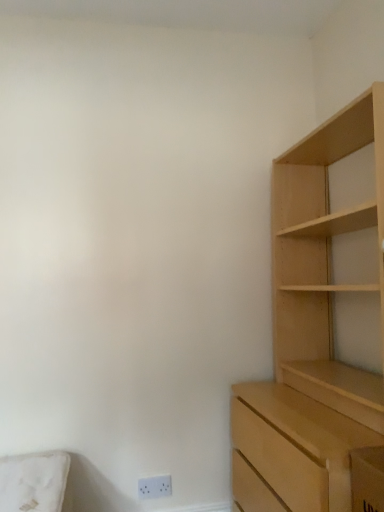
The height and width of the screenshot is (512, 384). In order to click on white plastic electric outlet at lower center in this screenshot , I will do `click(155, 487)`.

The width and height of the screenshot is (384, 512). Describe the element at coordinates (155, 487) in the screenshot. I see `white plastic electric outlet at lower center` at that location.

In order to face light wood cupboard at right, should I rotate leftwards or rightwards?

Rotate right and turn 17.130 degrees.

In order to click on light wood cupboard at right in this screenshot , I will do `click(311, 334)`.

What do you see at coordinates (311, 334) in the screenshot? Image resolution: width=384 pixels, height=512 pixels. I see `light wood cupboard at right` at bounding box center [311, 334].

The image size is (384, 512). Find the location of `white plastic electric outlet at lower center`. white plastic electric outlet at lower center is located at coordinates (155, 487).

Between white plastic electric outlet at lower center and light wood cupboard at right, which one appears on the left side from the viewer's perspective?

From the viewer's perspective, white plastic electric outlet at lower center appears more on the left side.

Considering the relative positions of white plastic electric outlet at lower center and light wood cupboard at right in the image provided, is white plastic electric outlet at lower center behind light wood cupboard at right?

Yes, the depth of white plastic electric outlet at lower center is greater than that of light wood cupboard at right.

Which is nearer, (150, 482) or (341, 217)?

Positioned in front is point (341, 217).

From the image's perspective, between white plastic electric outlet at lower center and light wood cupboard at right, which one is located above?

light wood cupboard at right.

From a real-world perspective, is white plastic electric outlet at lower center on light wood cupboard at right?

No, from a real-world perspective, white plastic electric outlet at lower center is not over light wood cupboard at right

Considering the sizes of objects white plastic electric outlet at lower center and light wood cupboard at right in the image provided, who is thinner, white plastic electric outlet at lower center or light wood cupboard at right?

With smaller width is white plastic electric outlet at lower center.

From the picture: Between white plastic electric outlet at lower center and light wood cupboard at right, which one has less height?

Standing shorter between the two is white plastic electric outlet at lower center.

Between white plastic electric outlet at lower center and light wood cupboard at right, which one has smaller size?

Smaller between the two is white plastic electric outlet at lower center.

Can we say white plastic electric outlet at lower center lies outside light wood cupboard at right?

white plastic electric outlet at lower center lies outside light wood cupboard at right's area.

Is white plastic electric outlet at lower center touching light wood cupboard at right?

No, white plastic electric outlet at lower center is not in contact with light wood cupboard at right.

Could you tell me if white plastic electric outlet at lower center is turned towards light wood cupboard at right?

No, white plastic electric outlet at lower center is not facing towards light wood cupboard at right.

What's the angular difference between white plastic electric outlet at lower center and light wood cupboard at right's facing directions?

The angular difference between white plastic electric outlet at lower center and light wood cupboard at right is 88 degrees.

Looking at this image, how far apart are white plastic electric outlet at lower center and light wood cupboard at right?

A distance of 38.41 inches exists between white plastic electric outlet at lower center and light wood cupboard at right.

At what (x,y) coordinates should I click in order to perform the action: click on electric outlet located underneath the light wood cupboard at right (from a real-world perspective). Please return your answer as a coordinate pair (x, y). Image resolution: width=384 pixels, height=512 pixels. Looking at the image, I should click on (155, 487).

Considering the positions of objects light wood cupboard at right and white plastic electric outlet at lower center in the image provided, who is more to the left, light wood cupboard at right or white plastic electric outlet at lower center?

From the viewer's perspective, white plastic electric outlet at lower center appears more on the left side.

Which object is closer to the camera taking this photo, light wood cupboard at right or white plastic electric outlet at lower center?

light wood cupboard at right is in front.

Between point (325, 170) and point (151, 485), which one is positioned behind?

Positioned behind is point (325, 170).

From the image's perspective, which is below, light wood cupboard at right or white plastic electric outlet at lower center?

From the image's view, white plastic electric outlet at lower center is below.

From a real-world perspective, between light wood cupboard at right and white plastic electric outlet at lower center, who is vertically higher?

light wood cupboard at right is physically above.

Is light wood cupboard at right thinner than white plastic electric outlet at lower center?

In fact, light wood cupboard at right might be wider than white plastic electric outlet at lower center.

Can you confirm if light wood cupboard at right is shorter than white plastic electric outlet at lower center?

No, light wood cupboard at right is not shorter than white plastic electric outlet at lower center.

In the scene shown: Considering the sizes of light wood cupboard at right and white plastic electric outlet at lower center in the image, is light wood cupboard at right bigger or smaller than white plastic electric outlet at lower center?

In the image, light wood cupboard at right appears to be larger than white plastic electric outlet at lower center.

Consider the image. Is white plastic electric outlet at lower center surrounded by light wood cupboard at right?

Actually, white plastic electric outlet at lower center is outside light wood cupboard at right.

Are light wood cupboard at right and white plastic electric outlet at lower center far apart?

That's not correct — light wood cupboard at right is a little close to white plastic electric outlet at lower center.

Is light wood cupboard at right looking in the opposite direction of white plastic electric outlet at lower center?

light wood cupboard at right does not have its back to white plastic electric outlet at lower center.

Can you tell me how much light wood cupboard at right and white plastic electric outlet at lower center differ in facing direction?

The angle between the facing direction of light wood cupboard at right and the facing direction of white plastic electric outlet at lower center is 88 degrees.

Where is `electric outlet located on the left of light wood cupboard at right`? This screenshot has height=512, width=384. electric outlet located on the left of light wood cupboard at right is located at coordinates (155, 487).

Identify the location of electric outlet that is under the light wood cupboard at right (from a real-world perspective). (155, 487).

This screenshot has width=384, height=512. Find the location of `cupboard lying on the right of white plastic electric outlet at lower center`. cupboard lying on the right of white plastic electric outlet at lower center is located at coordinates (311, 334).